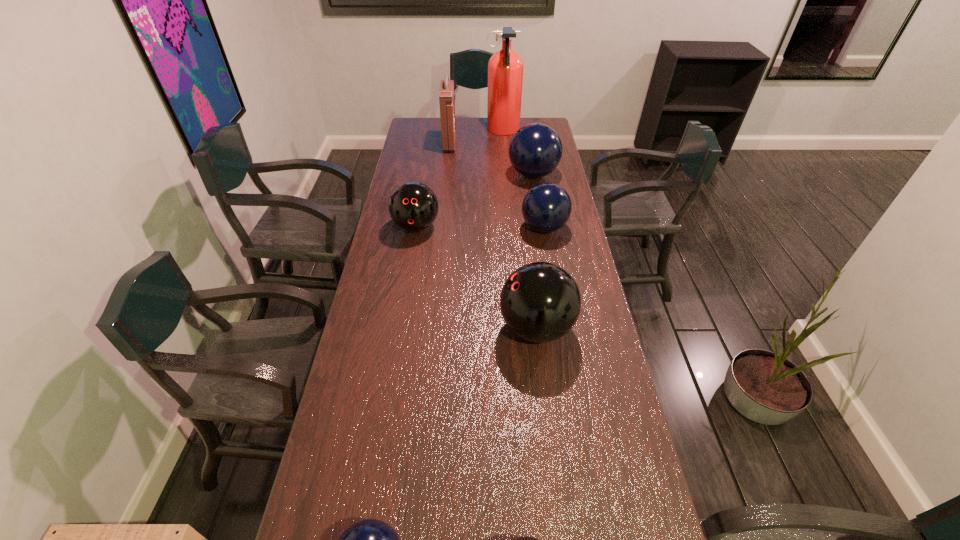
This screenshot has height=540, width=960. Identify the location of black bowling ball object that ranks as the closest to the farthest black bowling ball. (540, 302).

The image size is (960, 540). Identify the location of black bowling ball that stands as the second closest to the second farthest blue bowling ball. [x=413, y=206].

You are a GUI agent. You are given a task and a screenshot of the screen. Output one action in this format:
    pyautogui.click(x=<x>, y=<y>)
    Task: Click on the vacant area in the image that satisfies the following two spatial constraints: 1. on the front-facing side of the red first-aid kit; 2. on the surface of the second biggest black bowling ball near the finger holes
    This screenshot has width=960, height=540.
    Given the screenshot: What is the action you would take?
    pyautogui.click(x=441, y=227)